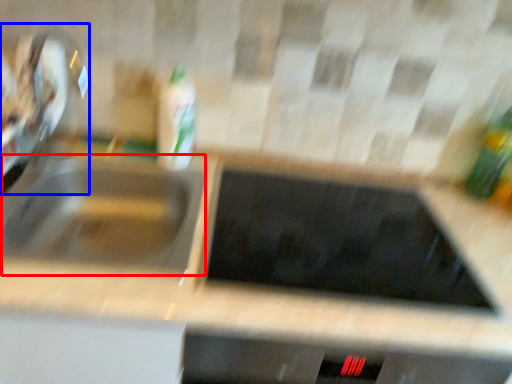
Question: Among these objects, which one is farthest to the camera, sink (highlighted by a red box) or faucet (highlighted by a blue box)?

Choices:
 (A) sink
 (B) faucet

Answer: (B)